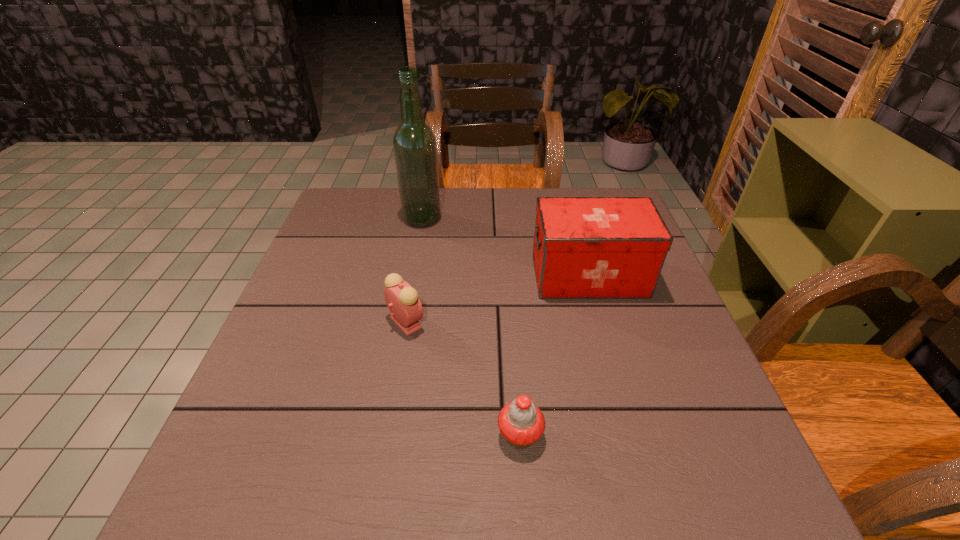
This screenshot has height=540, width=960. What are the coordinates of `vacant space at the near left corner of the desktop` in the screenshot? It's located at (211, 488).

Find the location of a particular element. free space at the near right corner is located at coordinates (738, 482).

This screenshot has height=540, width=960. Identify the location of free spot between the second farthest object and the tallest object. (506, 247).

Locate an element on the screen. empty location between the first-aid kit and the liquor is located at coordinates (506, 247).

Image resolution: width=960 pixels, height=540 pixels. Find the location of `vacant area that lies between the second tallest object and the cupcake`. vacant area that lies between the second tallest object and the cupcake is located at coordinates (555, 355).

Where is `free space between the second object from right to left and the rightmost object`? The image size is (960, 540). free space between the second object from right to left and the rightmost object is located at coordinates (555, 355).

Identify the location of vacant space that's between the third nearest object and the second nearest object. (497, 299).

I want to click on vacant point located between the farthest object and the first-aid kit, so click(506, 247).

Find the location of a particular element. This screenshot has width=960, height=540. empty space between the nearest object and the farthest object is located at coordinates (471, 327).

Where is `vacant area between the third nearest object and the second object from right to left`? The image size is (960, 540). vacant area between the third nearest object and the second object from right to left is located at coordinates 555,355.